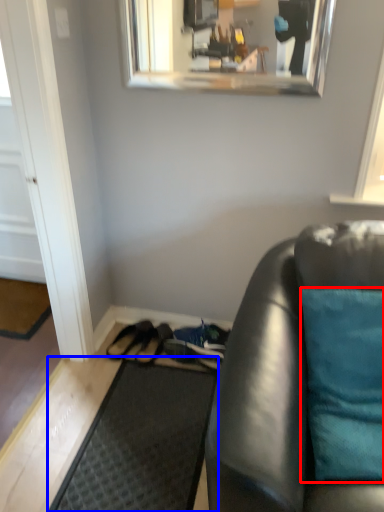
Question: Which object appears closest to the camera in this image, pillow (highlighted by a red box) or doormat (highlighted by a blue box)?

Choices:
 (A) pillow
 (B) doormat

Answer: (A)